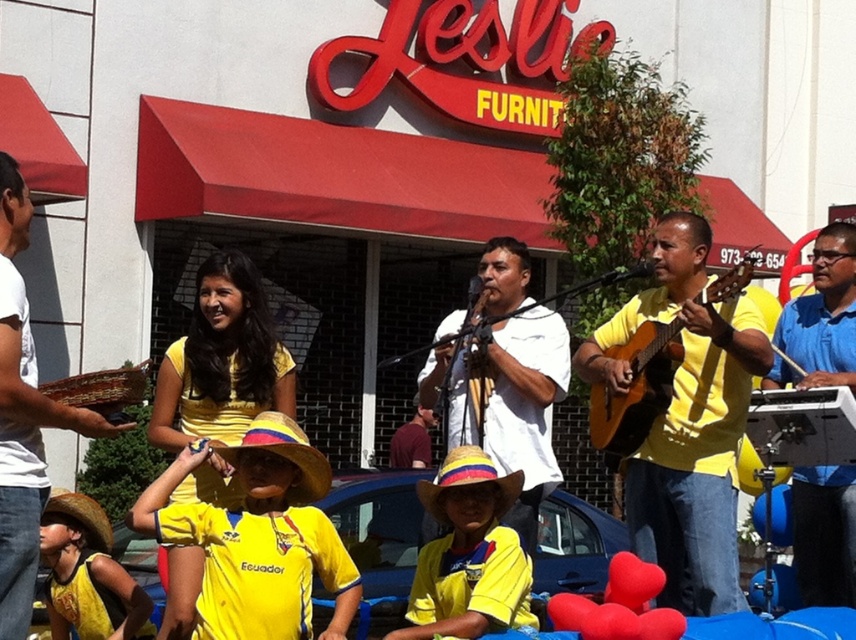
From the picture: Is matte yellow shirt at center above white woven basket at left?

No.

Can you confirm if matte yellow shirt at center is bigger than white woven basket at left?

No, matte yellow shirt at center is not bigger than white woven basket at left.

Does point (728, 394) come farther from viewer compared to point (30, 364)?

Yes, it is behind point (30, 364).

This screenshot has width=856, height=640. Identify the location of matte yellow shirt at center. (687, 420).

Based on the photo, between matte yellow shirt at center and yellow cotton shirt at lower center, which one has less height?

Standing shorter between the two is yellow cotton shirt at lower center.

Is point (688, 348) farther from viewer compared to point (484, 499)?

That is True.

Which is behind, point (710, 493) or point (498, 509)?

The point (710, 493) is more distant.

You are a GUI agent. You are given a task and a screenshot of the screen. Output one action in this format:
    pyautogui.click(x=<x>, y=<y>)
    Task: Click on the matte yellow shirt at center
    The width and height of the screenshot is (856, 640).
    Given the screenshot: What is the action you would take?
    pos(687,420)

Describe the element at coordinates (687, 420) in the screenshot. This screenshot has width=856, height=640. I see `matte yellow shirt at center` at that location.

Which of these two, matte yellow shirt at center or yellow matte hat at center, stands taller?

matte yellow shirt at center is taller.

Is point (697, 433) positioned in front of point (248, 604)?

No, it is behind (248, 604).

I want to click on matte yellow shirt at center, so point(687,420).